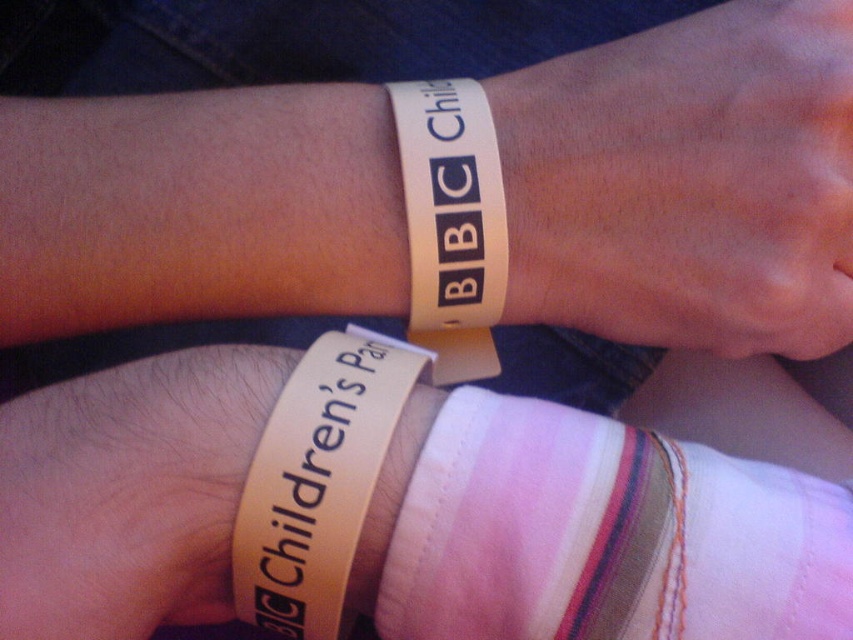
You are a store clerk organizing wristbands. You have a box that can only fit wristbands narrower than 3 centimeters. The white matte wristband at upper center and the tan rubber wristband at lower center are both in front of you. Based on their widths, which wristbands can you place into the box?

The tan rubber wristband at lower center can be placed into the box because its width is narrower than the white matte wristband at upper center, which is wider than 3 centimeters.

You are a security guard checking wristbands at an event entrance. You have two wristbands in front of you, the white matte wristband at upper center and the white paper wristband at upper right. Which wristband is taller?

The white matte wristband at upper center is taller than the white paper wristband at upper right.

You are examining two wristbands. You notice the tan rubber wristband at lower center and another wristband. Which wristband is positioned lower on the image?

The tan rubber wristband at lower center is located at point (318, 481), which is lower than the other wristband.